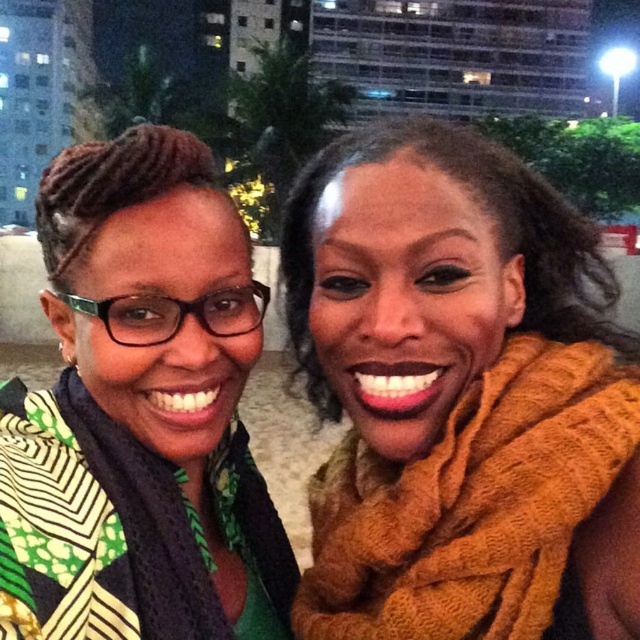
Based on the photo, can you confirm if green printed fabric at left is thinner than orange fuzzy scarf at right?

No.

Between green printed fabric at left and orange fuzzy scarf at right, which one appears on the left side from the viewer's perspective?

Positioned to the left is green printed fabric at left.

This screenshot has height=640, width=640. Find the location of `green printed fabric at left`. green printed fabric at left is located at coordinates (140, 412).